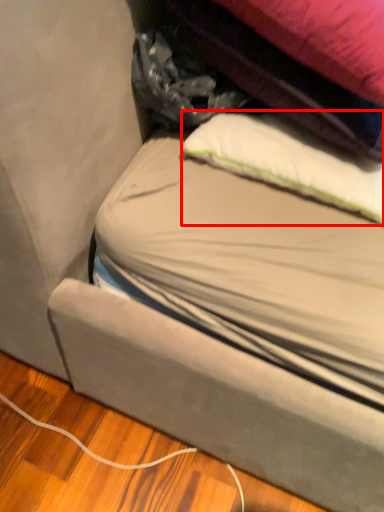
Question: Considering the relative positions of pillow (annotated by the red box) and bag in the image provided, where is pillow (annotated by the red box) located with respect to the staircase?

Choices:
 (A) right
 (B) left

Answer: (A)